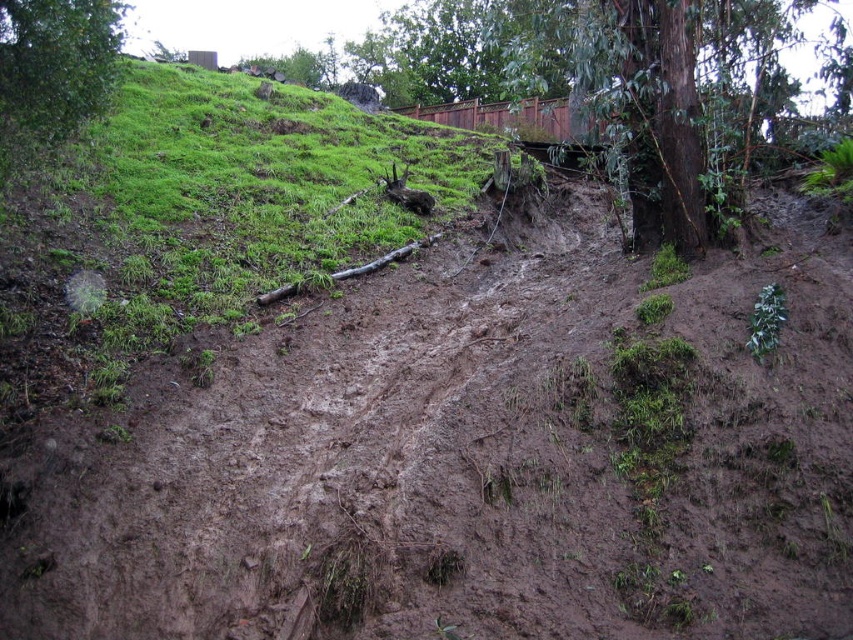
Question: In this image, where is brown muddy dirt track at center located relative to green grassy at upper left?

Choices:
 (A) below
 (B) above

Answer: (A)

Question: Is brown muddy dirt track at center bigger than green grassy at upper left?

Choices:
 (A) yes
 (B) no

Answer: (B)

Question: Can you confirm if green grassy at upper left is positioned below green leafy tree at upper left?

Choices:
 (A) no
 (B) yes

Answer: (B)

Question: Which point is farther from the camera taking this photo?

Choices:
 (A) (67, 61)
 (B) (431, 176)

Answer: (B)

Question: Which of the following is the farthest from the observer?

Choices:
 (A) (602, 438)
 (B) (24, 99)
 (C) (15, 326)

Answer: (C)

Question: Which of the following is the closest to the observer?

Choices:
 (A) click(x=532, y=388)
 (B) click(x=67, y=317)
 (C) click(x=6, y=68)

Answer: (C)